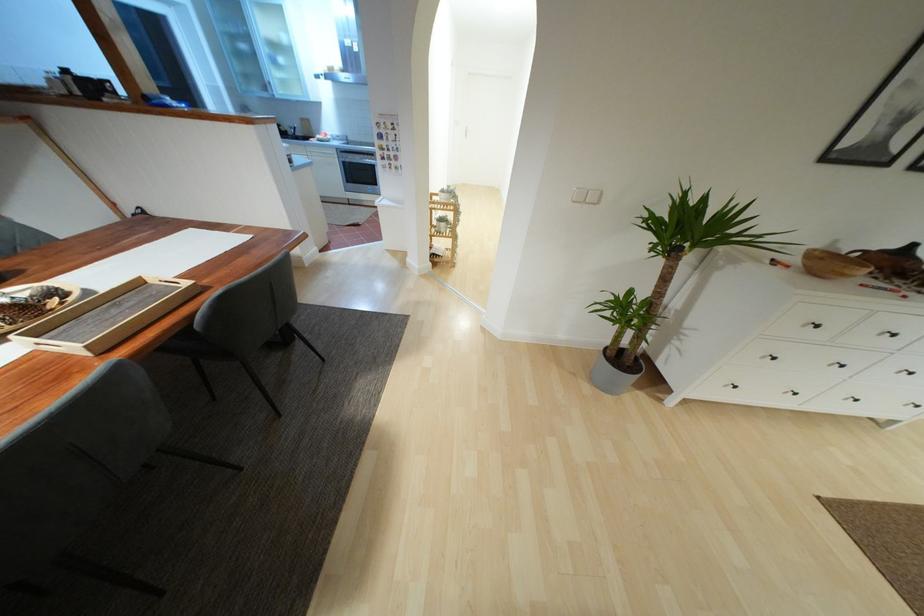
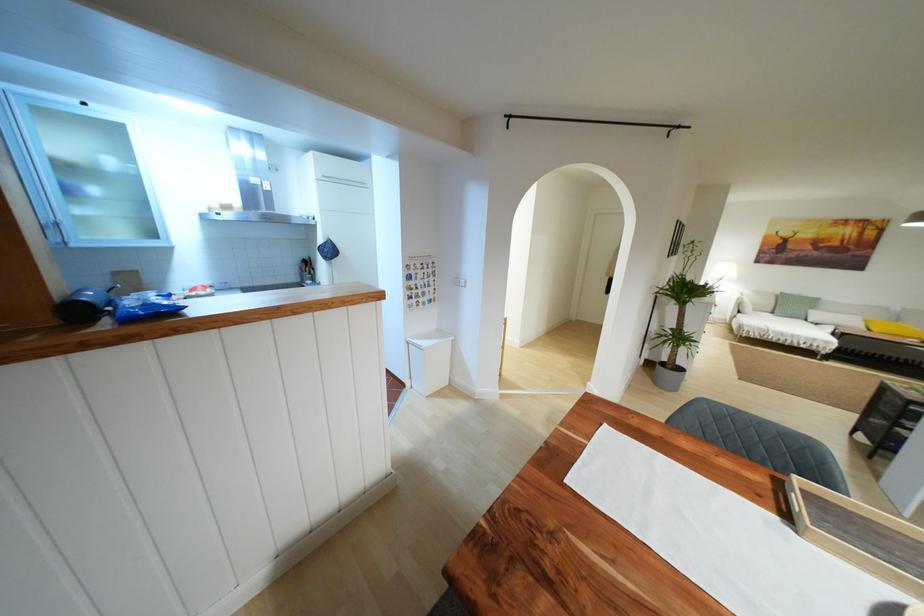
Find the pixel in the second image that matches pixel 670 390 in the first image.

(681, 370)